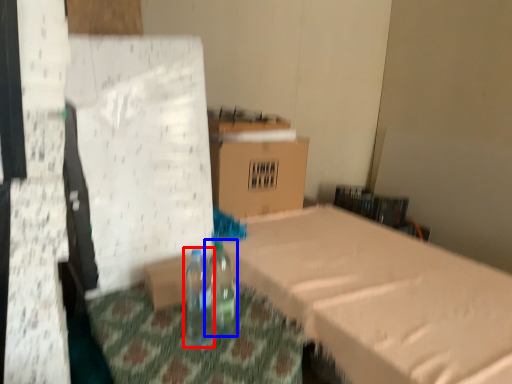
Question: Which point is closer to the camera, bottle (highlighted by a red box) or bottle (highlighted by a blue box)?

Choices:
 (A) bottle
 (B) bottle

Answer: (A)